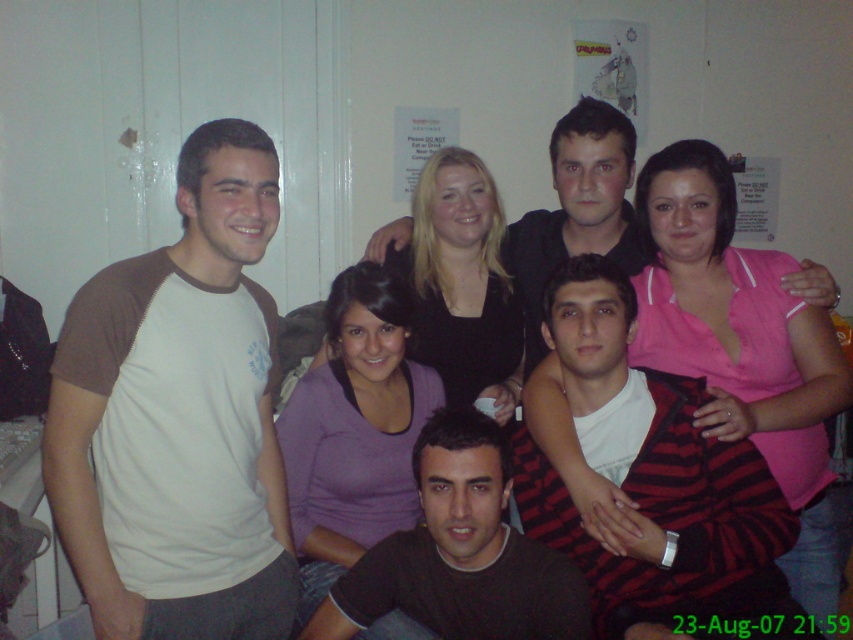
Question: Is white cotton t-shirt at left positioned in front of dark brown t-shirt at center?

Choices:
 (A) no
 (B) yes

Answer: (B)

Question: Which of the following is the farthest from the observer?

Choices:
 (A) (352, 540)
 (B) (544, 273)
 (C) (149, 358)

Answer: (B)

Question: Is pink cotton shirt at center further to the viewer compared to black matte shirt at center?

Choices:
 (A) yes
 (B) no

Answer: (B)

Question: Which is farther from the white cotton t-shirt at left?

Choices:
 (A) dark brown t-shirt at center
 (B) pink cotton shirt at center

Answer: (B)

Question: Among these points, which one is farthest from the camera?

Choices:
 (A) (374, 374)
 (B) (654, 554)

Answer: (A)

Question: Is white cotton t-shirt at left above black matte shirt at center?

Choices:
 (A) yes
 (B) no

Answer: (B)